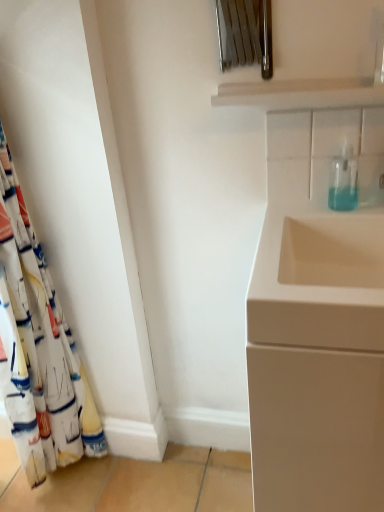
Question: Based on their positions, is transparent plastic soap dispenser at upper right located to the left or right of white fabric curtain at left?

Choices:
 (A) left
 (B) right

Answer: (B)

Question: Do you think transparent plastic soap dispenser at upper right is within white fabric curtain at left, or outside of it?

Choices:
 (A) inside
 (B) outside

Answer: (B)

Question: Which is nearer to the transparent plastic soap dispenser at upper right?

Choices:
 (A) white fabric curtain at left
 (B) matte white cabinet at right

Answer: (B)

Question: Which object is the farthest from the transparent plastic soap dispenser at upper right?

Choices:
 (A) white fabric curtain at left
 (B) matte white cabinet at right

Answer: (A)